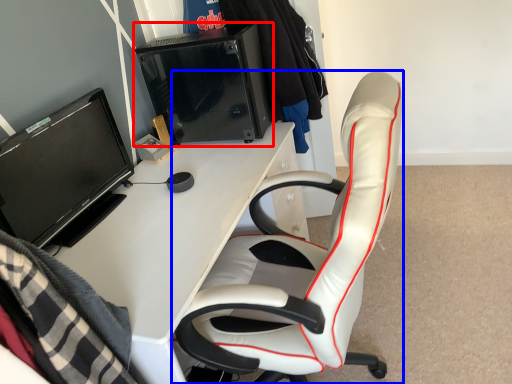
Question: Which object is further to the camera taking this photo, desktop computer (highlighted by a red box) or chair (highlighted by a blue box)?

Choices:
 (A) desktop computer
 (B) chair

Answer: (A)